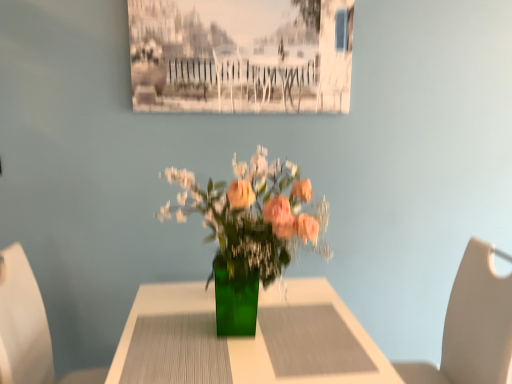
Question: Could you tell me if white plastic chair at left, which is counted as the first chair, starting from the left, is facing beige leather chair at right, the first chair in the right-to-left sequence?

Choices:
 (A) yes
 (B) no

Answer: (A)

Question: Could beige leather chair at right, the first chair in the right-to-left sequence, be considered to be inside white plastic chair at left, which is counted as the first chair, starting from the left?

Choices:
 (A) no
 (B) yes

Answer: (A)

Question: Does white plastic chair at left, which is counted as the first chair, starting from the left, have a greater width compared to beige leather chair at right, the 2th chair when ordered from left to right?

Choices:
 (A) yes
 (B) no

Answer: (B)

Question: Is white plastic chair at left, placed as the 2th chair when sorted from right to left, at the left side of beige leather chair at right, the first chair in the right-to-left sequence?

Choices:
 (A) no
 (B) yes

Answer: (B)

Question: Is white plastic chair at left, which is counted as the first chair, starting from the left, with beige leather chair at right, the first chair in the right-to-left sequence?

Choices:
 (A) no
 (B) yes

Answer: (A)

Question: Is white plastic chair at left, which is counted as the first chair, starting from the left, behind beige leather chair at right, the first chair in the right-to-left sequence?

Choices:
 (A) yes
 (B) no

Answer: (B)

Question: Does green glass vase at center appear on the left side of white plastic chair at left, placed as the 2th chair when sorted from right to left?

Choices:
 (A) yes
 (B) no

Answer: (B)

Question: Is green glass vase at center positioned behind white plastic chair at left, which is counted as the first chair, starting from the left?

Choices:
 (A) yes
 (B) no

Answer: (B)

Question: Is green glass vase at center directly adjacent to white plastic chair at left, placed as the 2th chair when sorted from right to left?

Choices:
 (A) yes
 (B) no

Answer: (B)

Question: Considering the relative sizes of green glass vase at center and white plastic chair at left, placed as the 2th chair when sorted from right to left, in the image provided, is green glass vase at center shorter than white plastic chair at left, placed as the 2th chair when sorted from right to left,?

Choices:
 (A) no
 (B) yes

Answer: (B)

Question: Could you tell me if green glass vase at center is facing white plastic chair at left, which is counted as the first chair, starting from the left?

Choices:
 (A) yes
 (B) no

Answer: (B)

Question: From a real-world perspective, is green glass vase at center over white plastic chair at left, placed as the 2th chair when sorted from right to left?

Choices:
 (A) no
 (B) yes

Answer: (A)

Question: From the image's perspective, is beige leather chair at right, the 2th chair when ordered from left to right, beneath green glass vase at center?

Choices:
 (A) yes
 (B) no

Answer: (B)